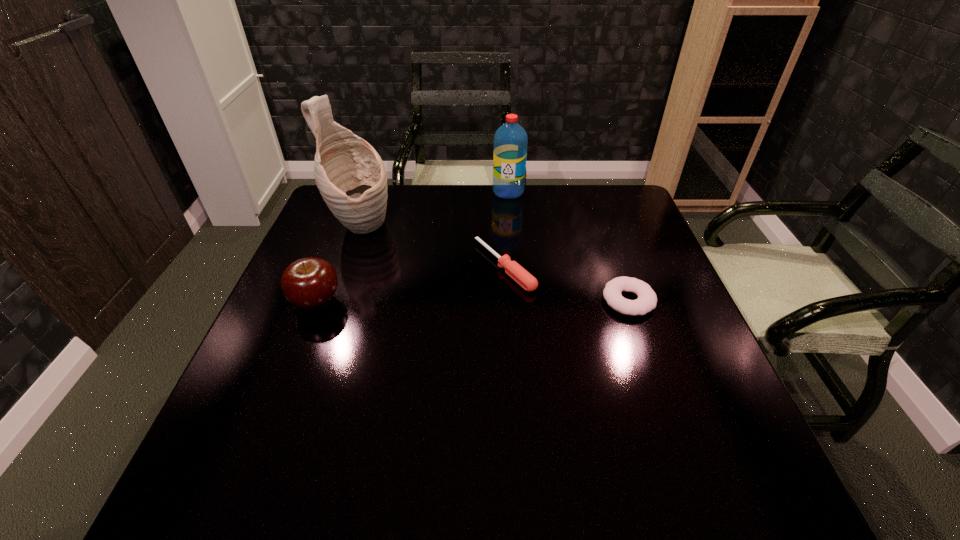
At what (x,y) coordinates should I click in order to perform the action: click on vacant space located 0.240m on the front label of the water bottle. Please return your answer as a coordinate pair (x, y). The width and height of the screenshot is (960, 540). Looking at the image, I should click on (479, 243).

You are a GUI agent. You are given a task and a screenshot of the screen. Output one action in this format:
    pyautogui.click(x=<x>, y=<y>)
    Task: Click on the vacant space situated 0.140m at the tip of the screwdriver
    
    Given the screenshot: What is the action you would take?
    pyautogui.click(x=432, y=305)

Where is `free space located 0.090m at the tip of the screwdriver`? free space located 0.090m at the tip of the screwdriver is located at coordinates (450, 296).

Find the location of a particular element. The image size is (960, 540). vacant area situated 0.090m at the tip of the screwdriver is located at coordinates (450, 296).

You are a GUI agent. You are given a task and a screenshot of the screen. Output one action in this format:
    pyautogui.click(x=<x>, y=<y>)
    Task: Click on the free space located 0.140m at the spout of the tallest object
    This screenshot has width=960, height=540.
    Given the screenshot: What is the action you would take?
    pyautogui.click(x=422, y=257)

Where is `vacant space situated at the spout of the tallest object`? Image resolution: width=960 pixels, height=540 pixels. vacant space situated at the spout of the tallest object is located at coordinates (502, 296).

Identify the location of vacant region located 0.380m at the spout of the tallest object. (495, 293).

Image resolution: width=960 pixels, height=540 pixels. In order to click on water bottle at the far edge in this screenshot , I will do `click(510, 140)`.

Where is `pitcher located in the far edge section of the desktop`? The image size is (960, 540). pitcher located in the far edge section of the desktop is located at coordinates (350, 175).

The image size is (960, 540). I want to click on apple at the left edge, so click(310, 283).